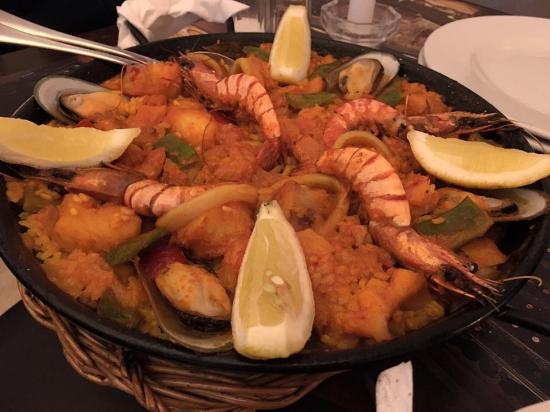
The image size is (550, 412). Find the location of `plate`. plate is located at coordinates (481, 66).